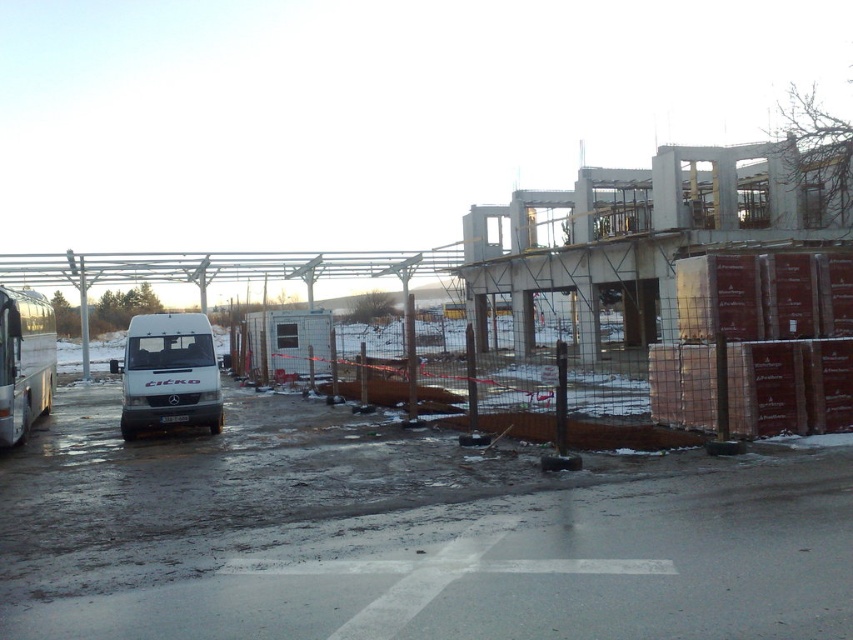
Question: Which point is farther from the camera taking this photo?

Choices:
 (A) (38, 412)
 (B) (160, 426)

Answer: (A)

Question: In this image, where is white matte van at left located relative to silver metallic bus at left?

Choices:
 (A) below
 (B) above

Answer: (A)

Question: Among these points, which one is nearest to the camera?

Choices:
 (A) (212, 339)
 (B) (7, 305)

Answer: (B)

Question: Which of the following is the closest to the observer?

Choices:
 (A) silver metallic bus at left
 (B) white matte van at left

Answer: (A)

Question: Is white matte van at left to the left of silver metallic bus at left from the viewer's perspective?

Choices:
 (A) yes
 (B) no

Answer: (B)

Question: Does white matte van at left appear under silver metallic bus at left?

Choices:
 (A) no
 (B) yes

Answer: (B)